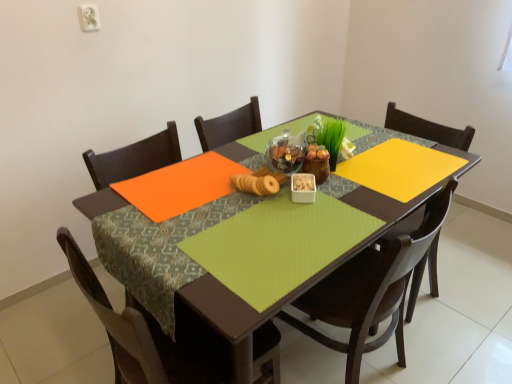
In order to click on vacant space to the left of white plastic container at center in this screenshot , I will do `click(250, 208)`.